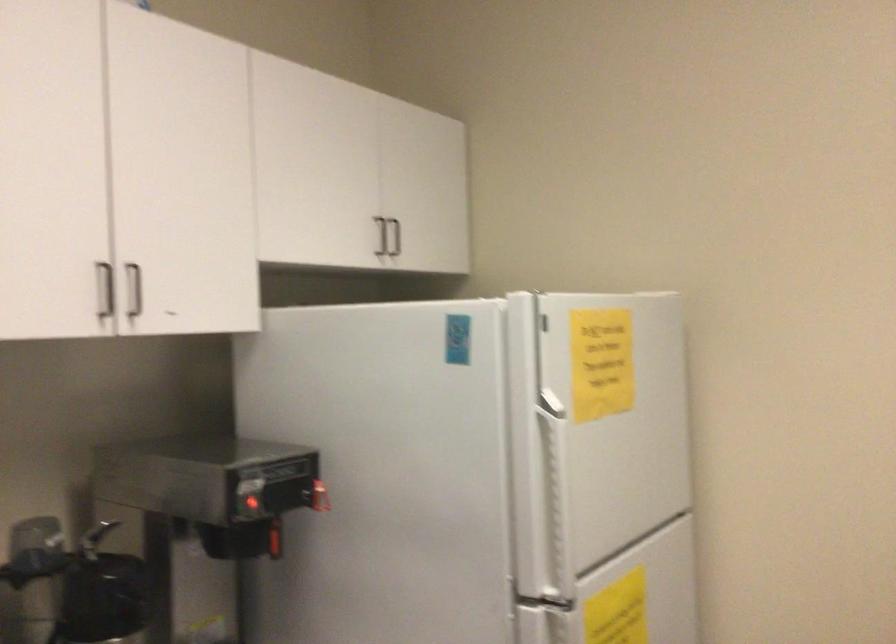
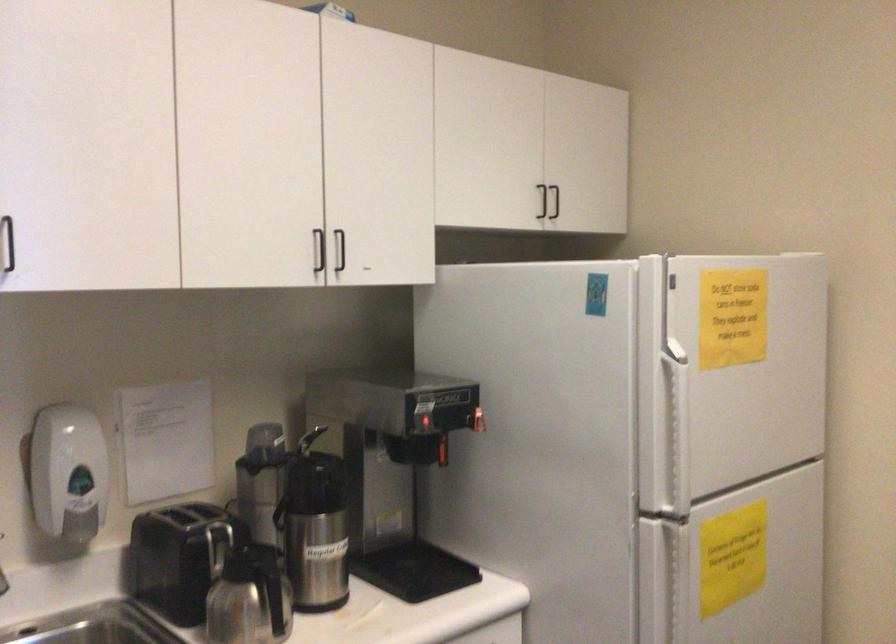
Question: I am providing you with two images of the same scene from different viewpoints. After the viewpoint changes to image2, which objects are now occluded?

Choices:
 (A) coffee carafe handle
 (B) black cabinet handle
 (C) soap dispenser lever
 (D) none of these

Answer: (D)